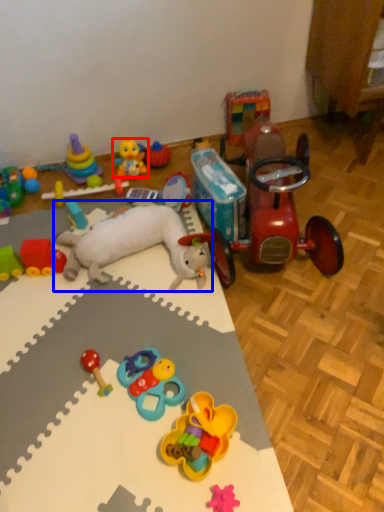
Question: Which object appears farthest to the camera in this image, toy (highlighted by a red box) or toy (highlighted by a blue box)?

Choices:
 (A) toy
 (B) toy

Answer: (A)